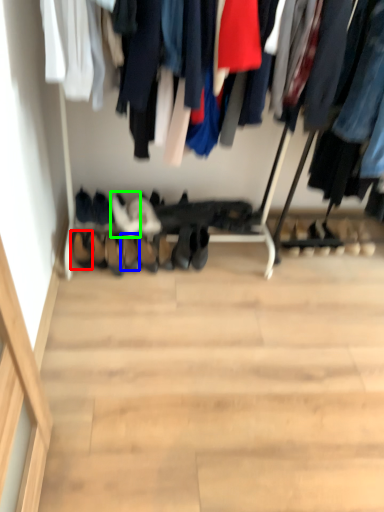
Question: Estimate the real-world distances between objects in this image. Which object is closer to shoe (highlighted by a red box), shoe (highlighted by a blue box) or footwear (highlighted by a green box)?

Choices:
 (A) shoe
 (B) footwear

Answer: (A)